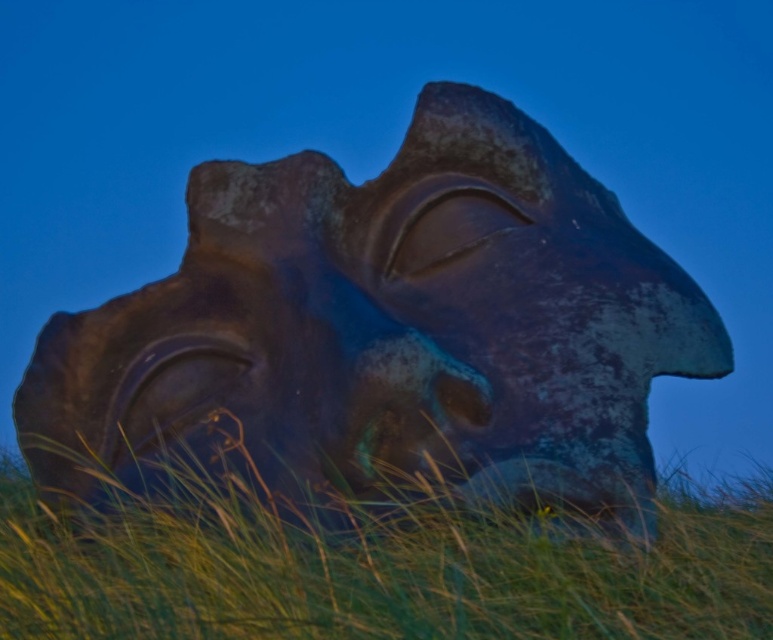
Question: Does rusty stone sculpture at center have a smaller size compared to green grass at lower center?

Choices:
 (A) no
 (B) yes

Answer: (A)

Question: Does rusty stone sculpture at center appear over green grass at lower center?

Choices:
 (A) no
 (B) yes

Answer: (B)

Question: Which of the following is the farthest from the observer?

Choices:
 (A) green grass at lower center
 (B) rusty stone sculpture at center

Answer: (B)

Question: Does rusty stone sculpture at center appear on the left side of green grass at lower center?

Choices:
 (A) yes
 (B) no

Answer: (B)

Question: Which of the following is the farthest from the observer?

Choices:
 (A) rusty stone sculpture at center
 (B) green grass at lower center

Answer: (A)

Question: Which point is closer to the camera?

Choices:
 (A) (651, 465)
 (B) (148, 531)

Answer: (B)